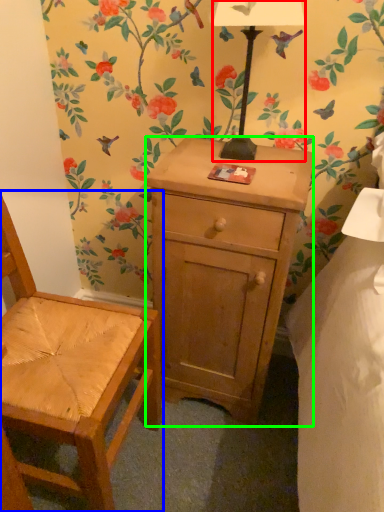
Question: Estimate the real-world distances between objects in this image. Which object is farther from lamp (highlighted by a red box), chair (highlighted by a blue box) or desk (highlighted by a green box)?

Choices:
 (A) chair
 (B) desk

Answer: (A)